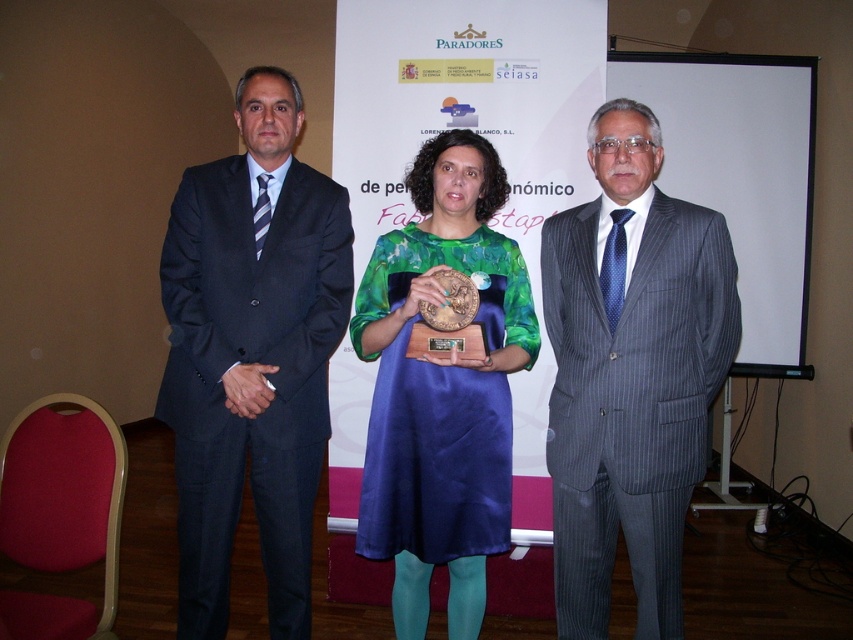
You are a photographer at the event and need to capture a photo of both the gray pinstripe suit at center and the green satin dress at center. Which one is on the right side?

The gray pinstripe suit at center is positioned on the right side of the green satin dress at center.

You are an event photographer who needs to capture a clear photo of the gray pinstripe suit at center and the green satin dress at center. Which one is blocking the other from view?

The gray pinstripe suit at center is positioned over the green satin dress at center, so it is blocking the view of the green satin dress at center.